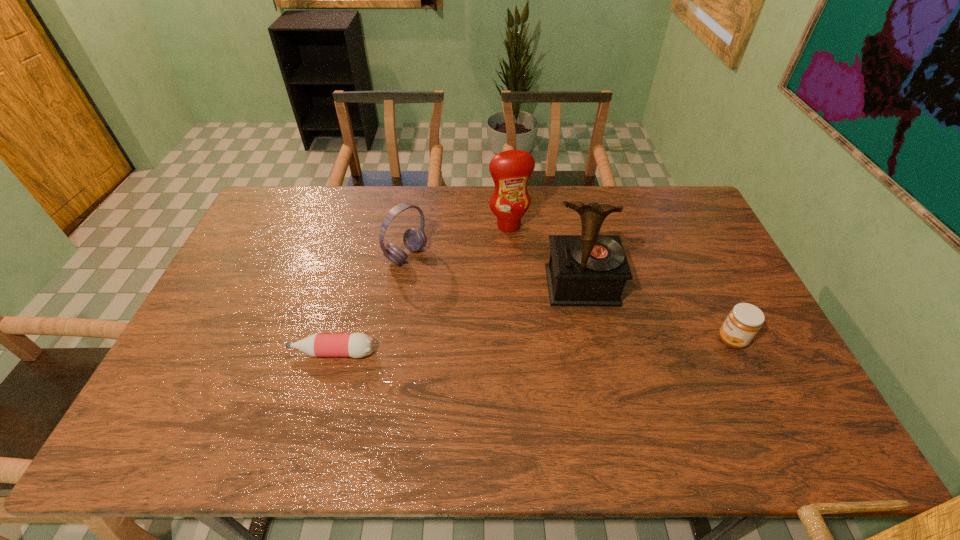
Where is `vacant space that satisfies the following two spatial constraints: 1. on the front side of the jam; 2. on the front label of the fourth shortest object`? The width and height of the screenshot is (960, 540). vacant space that satisfies the following two spatial constraints: 1. on the front side of the jam; 2. on the front label of the fourth shortest object is located at coordinates (516, 340).

Find the location of a particular element. The image size is (960, 540). free space that satisfies the following two spatial constraints: 1. on the front side of the jam; 2. on the front label of the fourth shortest object is located at coordinates [x=516, y=340].